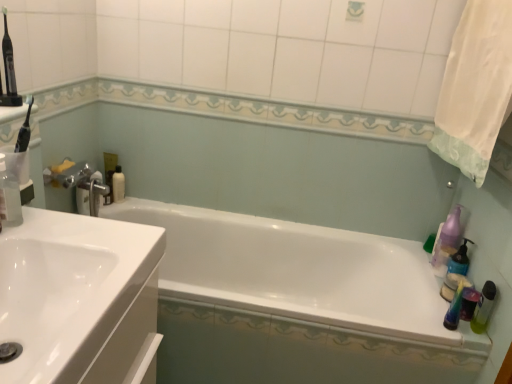
Find the location of a particular element. free point below white fabric shower curtain at upper right (from a real-world perspective) is located at coordinates (424, 269).